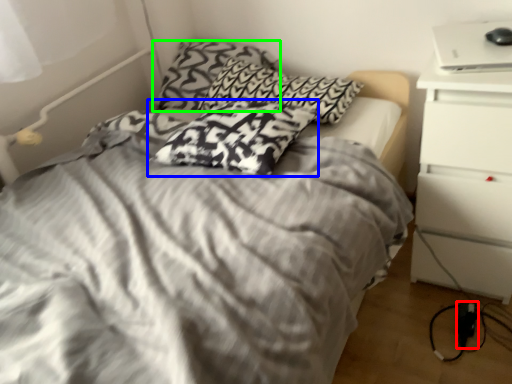
Question: Considering the real-world distances, which object is farthest from electric outlet (highlighted by a red box)? pillow (highlighted by a blue box) or pillow (highlighted by a green box)?

Choices:
 (A) pillow
 (B) pillow

Answer: (B)